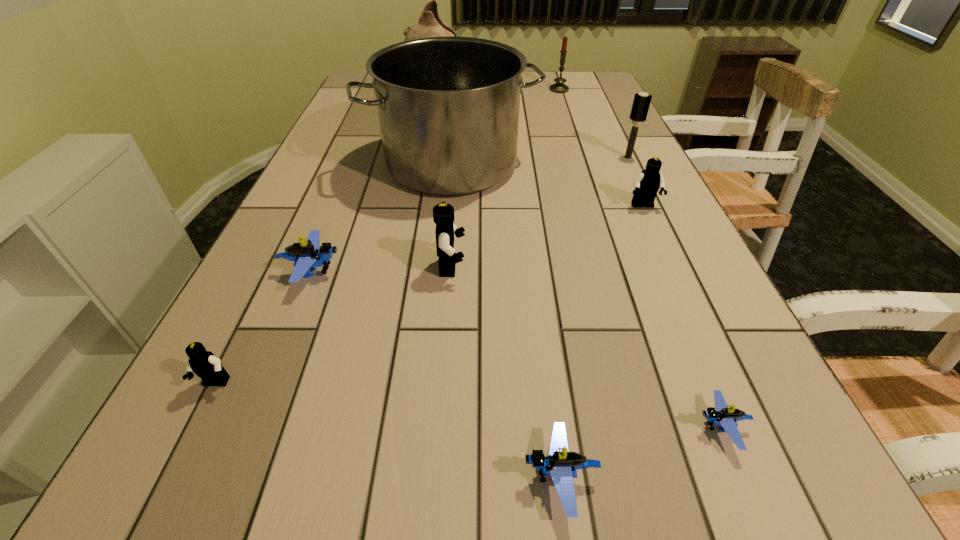
This screenshot has height=540, width=960. What are the coordinates of `free space that satisfies the following two spatial constraints: 1. from the spout of the pottery; 2. on the right side of the hairbrush` in the screenshot? It's located at (421, 157).